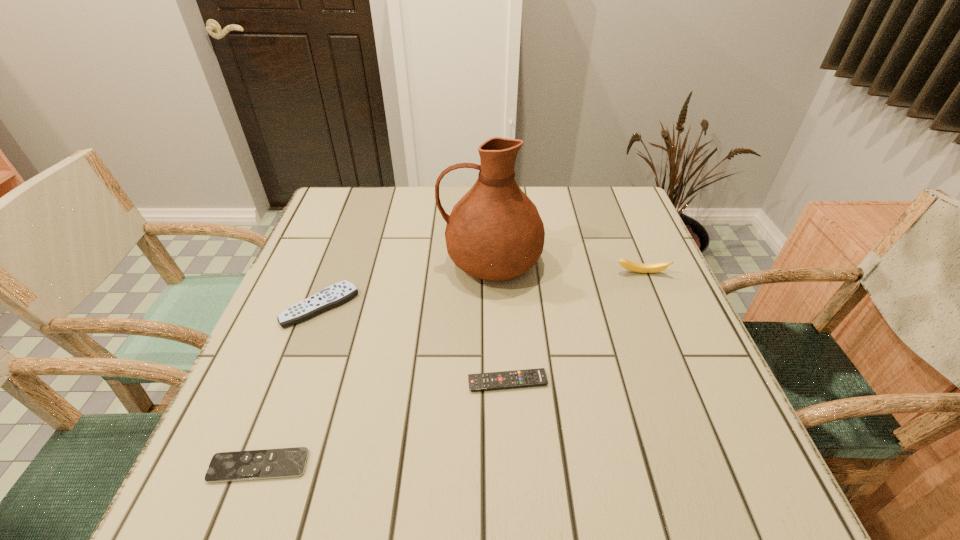
The image size is (960, 540). What are the coordinates of `vacant space located on the side of the tallest object with the handle` in the screenshot? It's located at (353, 261).

At what (x,y) coordinates should I click in order to perform the action: click on vacant point located on the side of the tallest object with the handle. Please return your answer as a coordinate pair (x, y). The width and height of the screenshot is (960, 540). Looking at the image, I should click on (298, 261).

I want to click on vacant space located 0.320m at the stem of the rightmost object, so click(x=689, y=389).

You are a GUI agent. You are given a task and a screenshot of the screen. Output one action in this format:
    pyautogui.click(x=<x>, y=<y>)
    Task: Click on the vacant area situated 0.380m on the back of the tallest remote control
    This screenshot has height=540, width=960.
    Given the screenshot: What is the action you would take?
    pyautogui.click(x=360, y=200)

Where is `vacant space positioned 0.190m on the right of the second farthest remote control`? vacant space positioned 0.190m on the right of the second farthest remote control is located at coordinates (646, 382).

You are a GUI agent. You are given a task and a screenshot of the screen. Output one action in this format:
    pyautogui.click(x=<x>, y=<y>)
    Task: Click on the free space located 0.220m on the back of the shortest object
    This screenshot has height=540, width=960.
    Given the screenshot: What is the action you would take?
    pyautogui.click(x=303, y=347)

You are a GUI agent. You are given a task and a screenshot of the screen. Output one action in this format:
    pyautogui.click(x=<x>, y=<y>)
    Task: Click on the object situated at the near edge
    This screenshot has width=960, height=540.
    Given the screenshot: What is the action you would take?
    pyautogui.click(x=285, y=462)

Find the location of a particular element. The height and width of the screenshot is (540, 960). object present at the right edge is located at coordinates (629, 265).

Where is `object that is at the near left corner`? object that is at the near left corner is located at coordinates (285, 462).

Locate an element on the screen. vacant space at the far edge of the desktop is located at coordinates (556, 215).